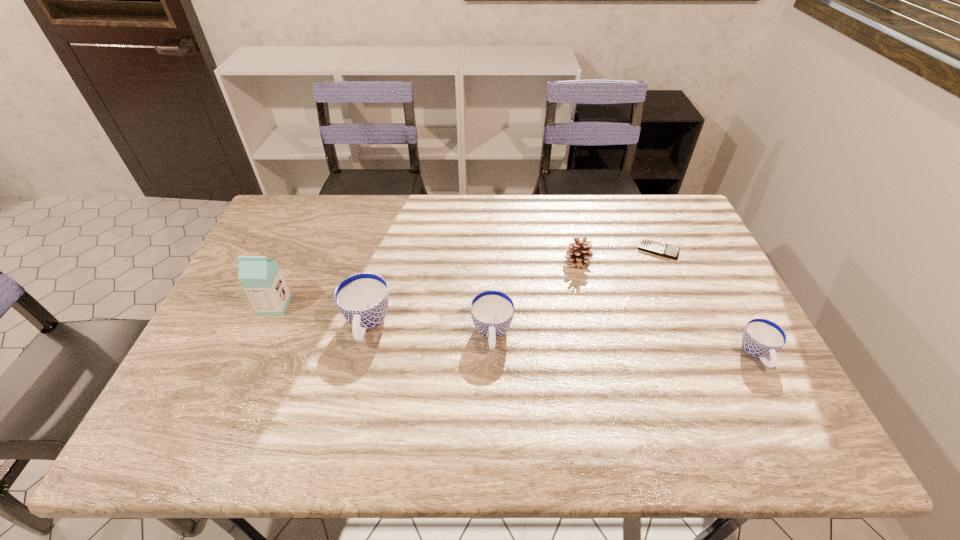
The image size is (960, 540). Find the location of `vacant space that is in between the second object from left to right and the fourth object from right to left`. vacant space that is in between the second object from left to right and the fourth object from right to left is located at coordinates (429, 329).

I want to click on vacant point located between the third object from left to right and the pinecone, so click(535, 298).

You are a GUI agent. You are given a task and a screenshot of the screen. Output one action in this format:
    pyautogui.click(x=<x>, y=<y>)
    Task: Click on the free space between the leftmost cup and the second cup from right to left
    This screenshot has height=540, width=960.
    Given the screenshot: What is the action you would take?
    pyautogui.click(x=429, y=329)

This screenshot has height=540, width=960. I want to click on vacant area that lies between the pinecone and the calculator, so click(x=618, y=255).

The image size is (960, 540). I want to click on object that is the fourth closest to the second cup from left to right, so click(x=261, y=278).

The width and height of the screenshot is (960, 540). I want to click on the second closest object to the second shortest cup, so click(x=578, y=254).

At what (x,y) coordinates should I click in order to perform the action: click on the third closest cup relative to the leftmost object. Please return your answer as a coordinate pair (x, y). This screenshot has height=540, width=960. Looking at the image, I should click on (762, 338).

You are a GUI agent. You are given a task and a screenshot of the screen. Output one action in this format:
    pyautogui.click(x=<x>, y=<y>)
    Task: Click on the cup that stands as the third closest to the second object from right to left
    This screenshot has width=960, height=540.
    Given the screenshot: What is the action you would take?
    (363, 298)